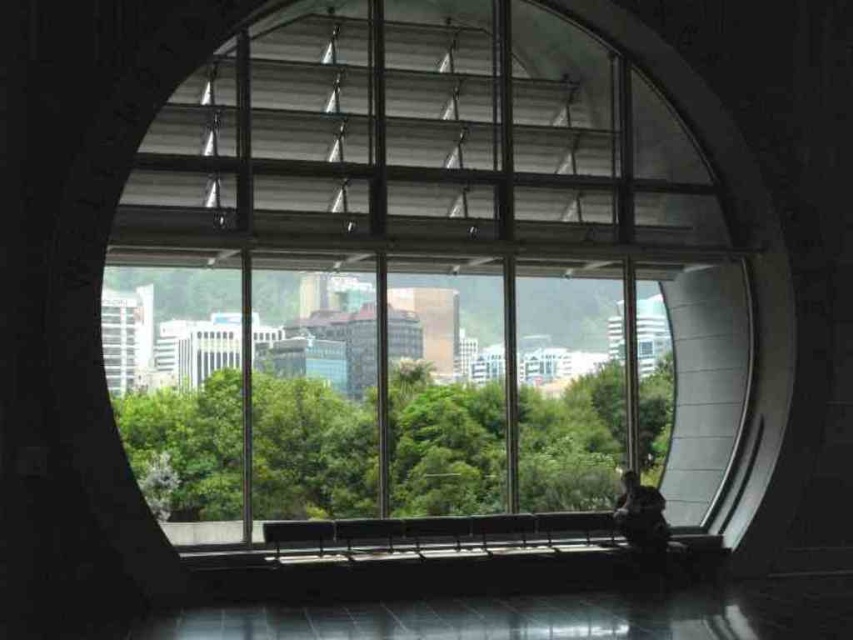
What do you see at coordinates (460, 188) in the screenshot? The height and width of the screenshot is (640, 853). I see `transparent glass window at center` at bounding box center [460, 188].

Is transparent glass window at center thinner than green leafy tree at center?

No, transparent glass window at center is not thinner than green leafy tree at center.

Between point (276, 113) and point (448, 483), which one is positioned in front?

Point (276, 113)

Locate an element on the screen. transparent glass window at center is located at coordinates (460, 188).